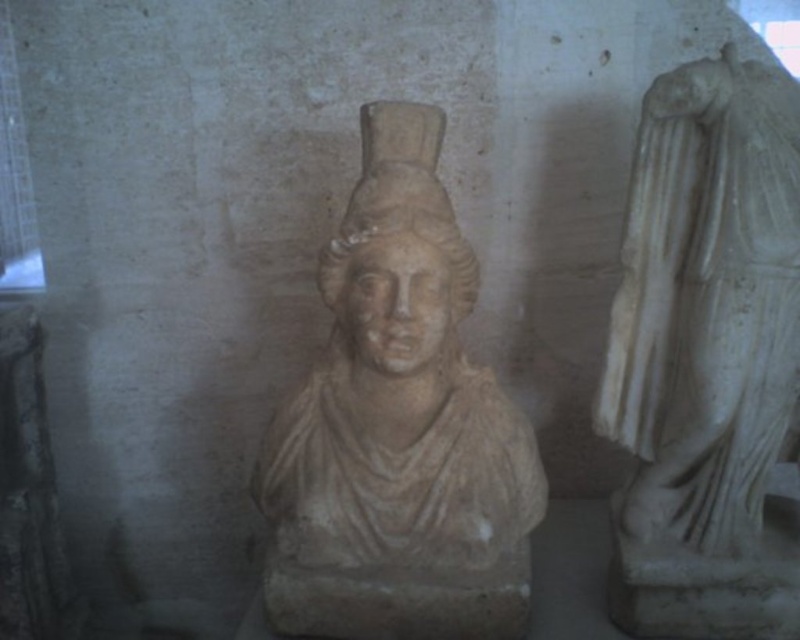
Question: Does beige stone bust at center appear on the left side of white marble statue at right?

Choices:
 (A) no
 (B) yes

Answer: (B)

Question: Which object is the closest to the beige stone bust at center?

Choices:
 (A) white marble statue at right
 (B) white stone bust at center

Answer: (B)

Question: Which point is closer to the camera?

Choices:
 (A) (444, 301)
 (B) (354, 221)

Answer: (B)

Question: Which is farther from the beige stone bust at center?

Choices:
 (A) white stone bust at center
 (B) white marble statue at right

Answer: (B)

Question: Can you confirm if beige stone bust at center is positioned to the left of white marble statue at right?

Choices:
 (A) no
 (B) yes

Answer: (B)

Question: Is white marble statue at right bigger than white stone bust at center?

Choices:
 (A) no
 (B) yes

Answer: (B)